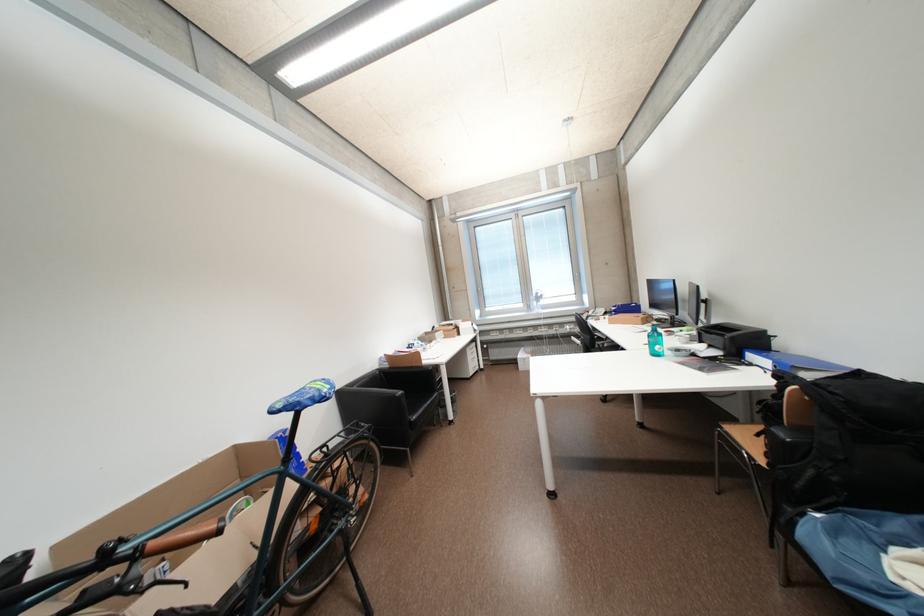
Where is `black sofa armrest`? black sofa armrest is located at coordinates (369, 402).